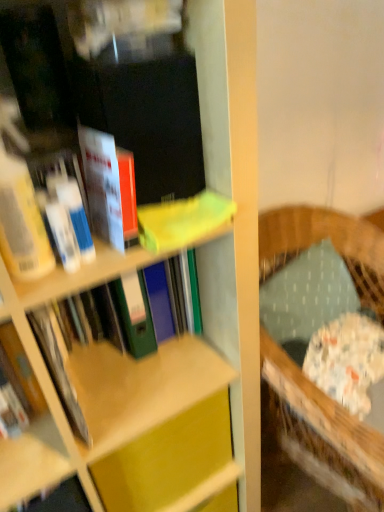
Question: Does point (91, 138) appear closer or farther from the camera than point (54, 379)?

Choices:
 (A) farther
 (B) closer

Answer: (B)

Question: Looking at the image, does matte plastic book at upper left, the 1th book from the front, seem bigger or smaller compared to matte green folder at center, positioned as the 1th book in back-to-front order?

Choices:
 (A) small
 (B) big

Answer: (A)

Question: Which is nearer to the matte plastic book at upper left, arranged as the third book when viewed from the back?

Choices:
 (A) wooden rocking chair at right
 (B) matte yellow book at upper center, which is counted as the second book, starting from the back
 (C) matte green folder at center, the third book viewed from the front
 (D) matte yellow cabinet at center
 (E) textured green pillow at right

Answer: (B)

Question: Which object is the closest to the textured green pillow at right?

Choices:
 (A) matte green folder at center, positioned as the 1th book in back-to-front order
 (B) wooden rocking chair at right
 (C) matte yellow cabinet at center
 (D) matte plastic book at upper left, arranged as the third book when viewed from the back
 (E) matte yellow book at upper center, the second book positioned from the front

Answer: (B)